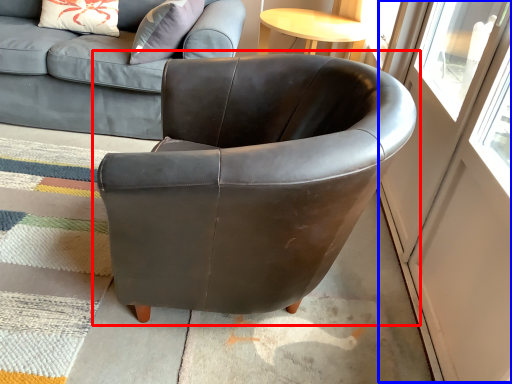
Question: Among these objects, which one is farthest to the camera, chair (highlighted by a red box) or screen door (highlighted by a blue box)?

Choices:
 (A) chair
 (B) screen door

Answer: (A)